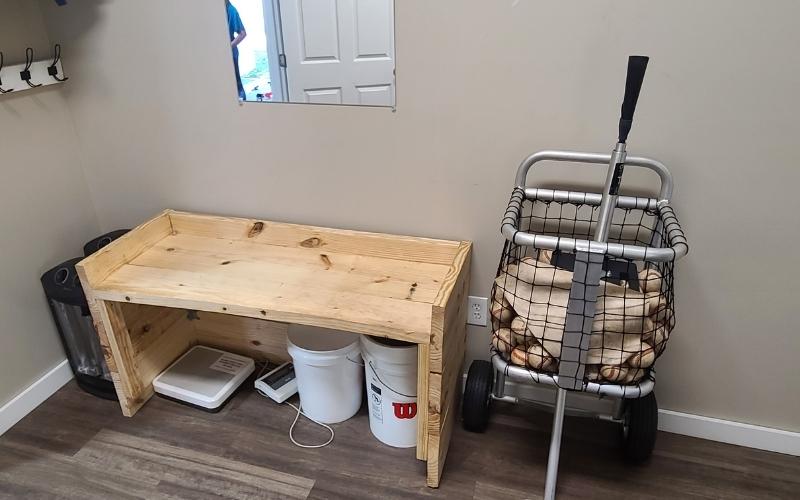
Find the location of a particular element. Image resolution: width=800 pixels, height=500 pixels. mirror is located at coordinates (x=350, y=78).